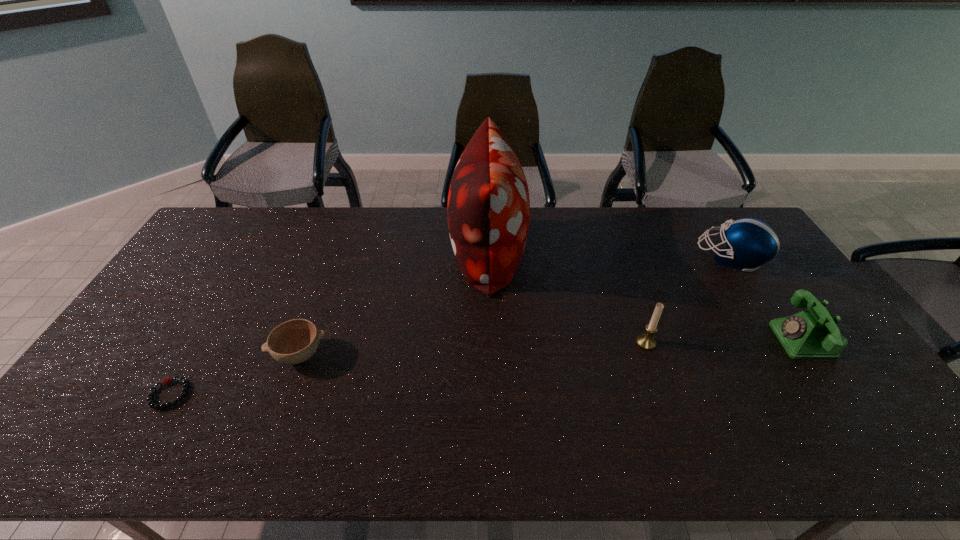
This screenshot has width=960, height=540. I want to click on vacant space at the right edge of the desktop, so click(821, 404).

The image size is (960, 540). I want to click on vacant region between the second shortest object and the football helmet, so click(516, 306).

The height and width of the screenshot is (540, 960). I want to click on blank region between the third object from right to left and the leftmost object, so click(408, 368).

In order to click on vacant area between the candle holder and the cushion in this screenshot , I will do `click(566, 298)`.

The image size is (960, 540). Find the location of `empty location between the fourth object from left to right and the bowl`. empty location between the fourth object from left to right and the bowl is located at coordinates (473, 348).

At what (x,y) coordinates should I click in order to perform the action: click on vacant area that lies between the football helmet and the bowl. Please return your answer as a coordinate pair (x, y). Looking at the image, I should click on (516, 306).

Locate an element on the screen. The width and height of the screenshot is (960, 540). vacant area between the cushion and the second object from left to right is located at coordinates [394, 303].

Locate an element on the screen. The width and height of the screenshot is (960, 540). unoccupied position between the cushion and the fourth tallest object is located at coordinates (645, 296).

Identify the location of blank region between the fifth object from right to left and the third object from left to right. (394, 303).

The image size is (960, 540). I want to click on free space between the third object from left to right and the football helmet, so click(x=610, y=255).